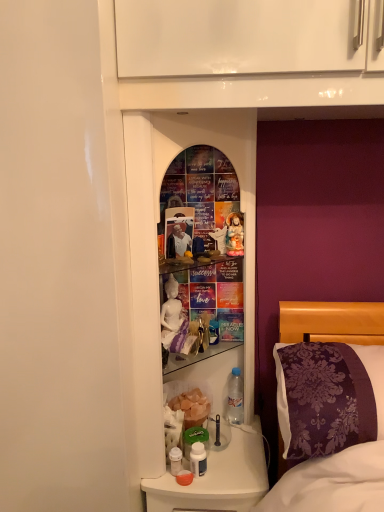
Question: Is clear plastic bottle at lower center, arranged as the first bottle when viewed from the top, positioned with its back to purple damask pillow at right?

Choices:
 (A) yes
 (B) no

Answer: (B)

Question: Can purple damask pillow at right be found inside clear plastic bottle at lower center, the 1th bottle viewed from the back?

Choices:
 (A) yes
 (B) no

Answer: (B)

Question: Is clear plastic bottle at lower center, the 2th bottle positioned from the left, not within purple damask pillow at right?

Choices:
 (A) yes
 (B) no

Answer: (A)

Question: Can you confirm if clear plastic bottle at lower center, arranged as the first bottle when viewed from the top, is wider than purple damask pillow at right?

Choices:
 (A) no
 (B) yes

Answer: (A)

Question: From the image's perspective, is clear plastic bottle at lower center, arranged as the 1th bottle when viewed from the right, located beneath purple damask pillow at right?

Choices:
 (A) yes
 (B) no

Answer: (A)

Question: Does translucent plastic bottles at lower center have a greater height compared to matte white photo frame at center?

Choices:
 (A) no
 (B) yes

Answer: (B)

Question: From a real-world perspective, is translucent plastic bottles at lower center positioned over matte white photo frame at center based on gravity?

Choices:
 (A) no
 (B) yes

Answer: (A)

Question: Is translucent plastic bottles at lower center oriented towards matte white photo frame at center?

Choices:
 (A) yes
 (B) no

Answer: (B)

Question: From the image's perspective, is translucent plastic bottles at lower center located above matte white photo frame at center?

Choices:
 (A) no
 (B) yes

Answer: (A)

Question: Would you consider translucent plastic bottles at lower center to be distant from matte white photo frame at center?

Choices:
 (A) no
 (B) yes

Answer: (A)

Question: Is matte white photo frame at center surrounded by translucent plastic bottles at lower center?

Choices:
 (A) yes
 (B) no

Answer: (B)

Question: Is translucent plastic bottles at lower center thinner than clear plastic bottle at lower center, arranged as the 1th bottle when viewed from the right?

Choices:
 (A) no
 (B) yes

Answer: (A)